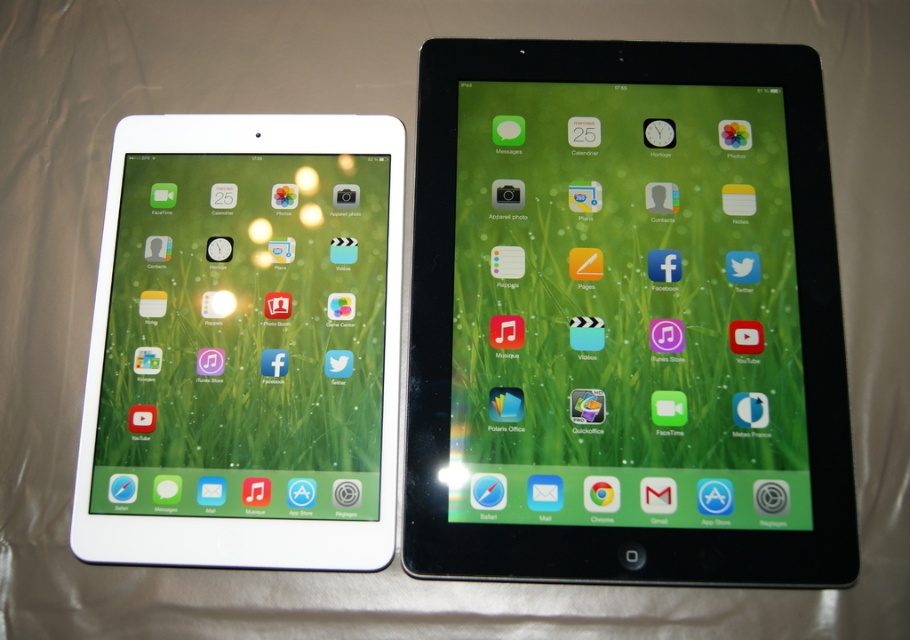
Which of these two, black glossy tablet at upper right or white glossy tablet at left, stands taller?

Standing taller between the two is black glossy tablet at upper right.

Can you confirm if black glossy tablet at upper right is positioned above white glossy tablet at left?

Correct, black glossy tablet at upper right is located above white glossy tablet at left.

Does point (635, 218) come closer to viewer compared to point (226, 380)?

No, (635, 218) is behind (226, 380).

Locate an element on the screen. black glossy tablet at upper right is located at coordinates (625, 317).